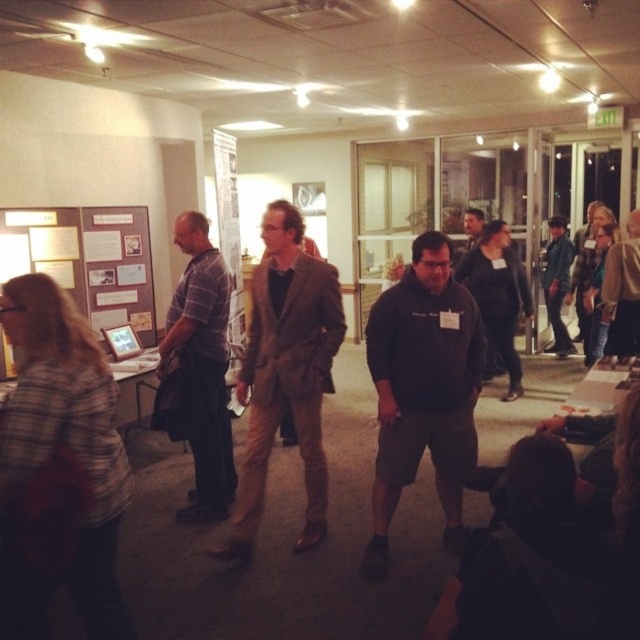
Is brown wool blazer at center to the right of denim jacket at right from the viewer's perspective?

No, brown wool blazer at center is not to the right of denim jacket at right.

Can you confirm if brown wool blazer at center is wider than denim jacket at right?

Yes, brown wool blazer at center is wider than denim jacket at right.

Between point (304, 461) and point (545, 264), which one is positioned behind?

The point (545, 264) is more distant.

At what (x,y) coordinates should I click in order to perform the action: click on brown wool blazer at center. Please return your answer as a coordinate pair (x, y). Image resolution: width=640 pixels, height=640 pixels. Looking at the image, I should click on (285, 372).

Does brown leather jacket at center have a greater width compared to denim jacket at right?

Yes.

Does brown leather jacket at center have a smaller size compared to denim jacket at right?

Yes, brown leather jacket at center is smaller than denim jacket at right.

Which is behind, point (630, 241) or point (564, 284)?

The point (564, 284) is more distant.

You are a GUI agent. You are given a task and a screenshot of the screen. Output one action in this format:
    pyautogui.click(x=<x>, y=<y>)
    Task: Click on the brown leather jacket at center
    The width and height of the screenshot is (640, 640).
    Given the screenshot: What is the action you would take?
    pyautogui.click(x=621, y=291)

Is dark gray hoodie at center positioned before denim jacket at right?

Yes, dark gray hoodie at center is in front of denim jacket at right.

Where is `dark gray hoodie at center`? The height and width of the screenshot is (640, 640). dark gray hoodie at center is located at coordinates (422, 388).

Measure the distance between point (385, 509) and camera.

10.21 feet

Find the location of a particular element. dark gray hoodie at center is located at coordinates (422, 388).